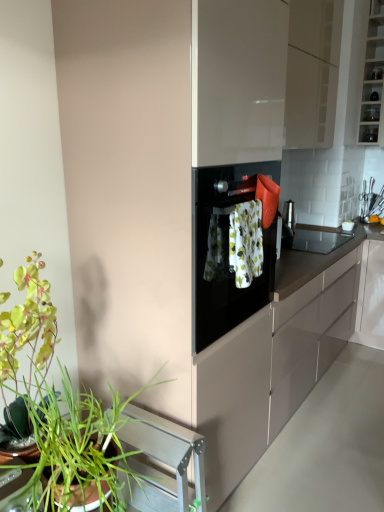
Question: Is floral fabric towel at center to the left or to the right of black matte countertop at center in the image?

Choices:
 (A) right
 (B) left

Answer: (B)

Question: Is floral fabric towel at center wider or thinner than black matte countertop at center?

Choices:
 (A) thin
 (B) wide

Answer: (A)

Question: Which object is the closest to the black matte countertop at center?

Choices:
 (A) floral fabric towel at center
 (B) green leafy plant at lower left
 (C) clear glass shelves at upper right, marked as the 2th cabinetry in a left-to-right arrangement
 (D) glossy beige cabinet at upper center, which is counted as the 1th cabinetry, starting from the left

Answer: (A)

Question: Which of these objects is positioned closest to the black matte countertop at center?

Choices:
 (A) floral fabric towel at center
 (B) glossy beige cabinet at upper center, which appears as the second cabinetry when viewed from the right
 (C) clear glass shelves at upper right, marked as the 2th cabinetry in a left-to-right arrangement
 (D) green leafy plant at lower left

Answer: (A)